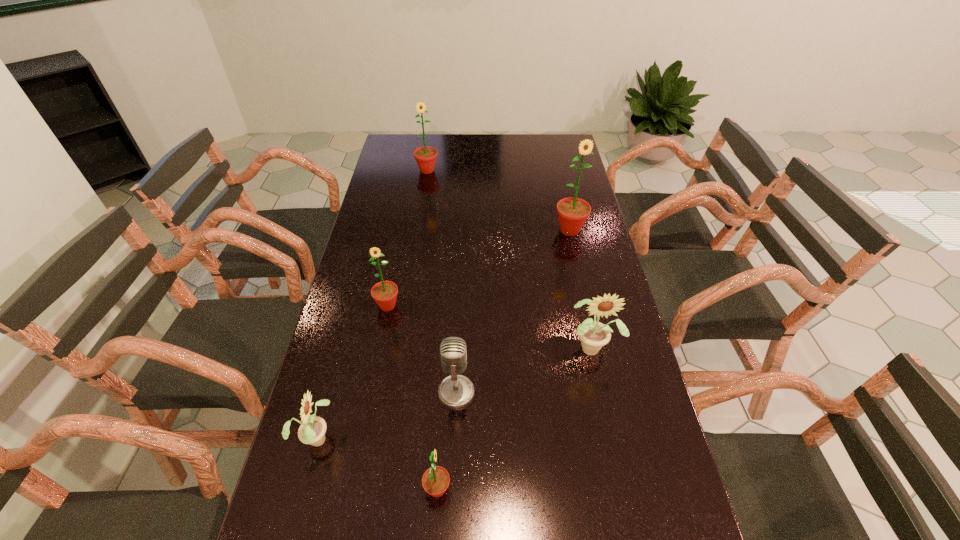
Where is `the nearer yellow sunflower`? The image size is (960, 540). the nearer yellow sunflower is located at coordinates [x=312, y=431].

This screenshot has width=960, height=540. Find the location of `the leftmost sunflower`. the leftmost sunflower is located at coordinates (312, 431).

The height and width of the screenshot is (540, 960). I want to click on the nearest object, so click(x=435, y=481).

You are a GUI agent. You are given a task and a screenshot of the screen. Output one action in this format:
    pyautogui.click(x=<x>, y=<y>)
    Task: Click on the smallest green sunflower
    This screenshot has width=960, height=540.
    Given the screenshot: What is the action you would take?
    pyautogui.click(x=435, y=481)

Where is `free space located 0.190m on the face of the second farthest object`? The height and width of the screenshot is (540, 960). free space located 0.190m on the face of the second farthest object is located at coordinates (581, 280).

The image size is (960, 540). Identify the location of free spot located on the face of the farthest green sunflower. (418, 232).

I want to click on free location located on the face of the third farthest object, so click(373, 378).

Find the location of a particular element. This screenshot has width=960, height=540. free location located 0.140m on the front-facing side of the bigger yellow sunflower is located at coordinates (608, 413).

Identify the location of vacant space situated 0.300m on the back of the third nearest object. (461, 292).

This screenshot has width=960, height=540. I want to click on vacant space located on the front-facing side of the leftmost object, so click(x=476, y=437).